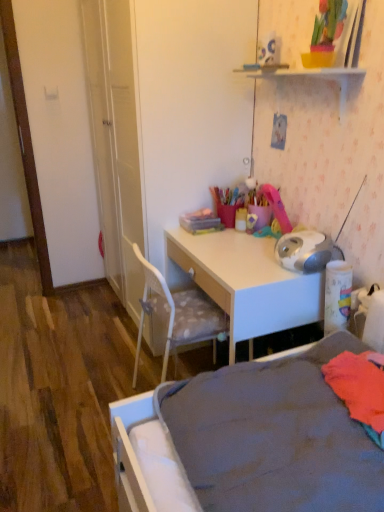
Locate an element on the screen. This screenshot has width=384, height=512. white glossy desk at center is located at coordinates (244, 282).

Where is `gray fabric bed at lower right`? Image resolution: width=384 pixels, height=512 pixels. gray fabric bed at lower right is located at coordinates [x=275, y=437].

Where is `white plastic shelf at upper center`? The height and width of the screenshot is (512, 384). white plastic shelf at upper center is located at coordinates (311, 77).

From a real-world perspective, is white plastic shelf at upper center physically below white glossy desk at center?

Actually, white plastic shelf at upper center is physically above white glossy desk at center in the real world.

Is white plastic shelf at upper center aimed at white glossy desk at center?

No, white plastic shelf at upper center does not turn towards white glossy desk at center.

Between white plastic shelf at upper center and white glossy desk at center, which one has smaller size?

With smaller size is white plastic shelf at upper center.

Is white glossy desk at center far away from white plastic shelf at upper center?

No, there isn't a large distance between white glossy desk at center and white plastic shelf at upper center.

Is white glossy desk at center outside of white plastic shelf at upper center?

That's correct, white glossy desk at center is outside of white plastic shelf at upper center.

Consider the image. Is white glossy desk at center taller than white plastic shelf at upper center?

Yes, white glossy desk at center is taller than white plastic shelf at upper center.

From the image's perspective, relative to white plastic shelf at upper center, is white glossy desk at center above or below?

Based on their image positions, white glossy desk at center is located beneath white plastic shelf at upper center.

Is white plastic shelf at upper center in front of gray fabric bed at lower right?

No, white plastic shelf at upper center is further to the viewer.

Is white plastic shelf at upper center taller or shorter than gray fabric bed at lower right?

white plastic shelf at upper center is taller than gray fabric bed at lower right.

Which is correct: white plastic shelf at upper center is inside gray fabric bed at lower right, or outside of it?

white plastic shelf at upper center is located beyond the bounds of gray fabric bed at lower right.

Is gray fabric bed at lower right facing away from white plastic shelf at upper center?

No, gray fabric bed at lower right is not facing the opposite direction of white plastic shelf at upper center.

Between gray fabric bed at lower right and white plastic shelf at upper center, which one has smaller size?

white plastic shelf at upper center is smaller.

Can we say gray fabric bed at lower right lies outside white plastic shelf at upper center?

gray fabric bed at lower right is positioned outside white plastic shelf at upper center.

Is gray fabric bed at lower right shorter than white plastic shelf at upper center?

Indeed, gray fabric bed at lower right has a lesser height compared to white plastic shelf at upper center.

In the scene shown: Is white glossy desk at center to the right of gray fabric bed at lower right from the viewer's perspective?

In fact, white glossy desk at center is to the left of gray fabric bed at lower right.

In the scene shown: Is white glossy desk at center behind gray fabric bed at lower right?

Yes, it is behind gray fabric bed at lower right.

Where is `bed that is in front of the white glossy desk at center`? This screenshot has width=384, height=512. bed that is in front of the white glossy desk at center is located at coordinates (275, 437).

Does white glossy desk at center have a larger size compared to gray fabric bed at lower right?

Indeed, white glossy desk at center has a larger size compared to gray fabric bed at lower right.

Is gray fabric bed at lower right inside or outside of white glossy desk at center?

gray fabric bed at lower right lies outside white glossy desk at center.

Between gray fabric bed at lower right and white glossy desk at center, which one has smaller width?

With smaller width is white glossy desk at center.

The image size is (384, 512). Find the location of `desk on the left side of gray fabric bed at lower right`. desk on the left side of gray fabric bed at lower right is located at coordinates (244, 282).

Who is bigger, gray fabric bed at lower right or white glossy desk at center?

white glossy desk at center is bigger.

Image resolution: width=384 pixels, height=512 pixels. Find the location of `desk below the white plastic shelf at upper center (from the image's perspective)`. desk below the white plastic shelf at upper center (from the image's perspective) is located at coordinates (244, 282).

Locate an element on the screen. desk lying on the left of white plastic shelf at upper center is located at coordinates (244, 282).

Consider the image. When comparing their distances from white plastic shelf at upper center, does white glossy desk at center or gray fabric bed at lower right seem further?

Among the two, gray fabric bed at lower right is located further to white plastic shelf at upper center.

Looking at the image, which one is located closer to gray fabric bed at lower right, white glossy desk at center or white plastic shelf at upper center?

The object closer to gray fabric bed at lower right is white glossy desk at center.

Looking at the image, which one is located closer to white glossy desk at center, gray fabric bed at lower right or white plastic shelf at upper center?

Among the two, gray fabric bed at lower right is located nearer to white glossy desk at center.

Considering their positions, is white plastic shelf at upper center positioned closer to gray fabric bed at lower right than white glossy desk at center?

white glossy desk at center.

Considering their positions, is gray fabric bed at lower right positioned closer to white plastic shelf at upper center than white glossy desk at center?

Based on the image, white glossy desk at center appears to be nearer to white plastic shelf at upper center.

Based on their spatial positions, is white plastic shelf at upper center or gray fabric bed at lower right closer to white glossy desk at center?

Among the two, gray fabric bed at lower right is located nearer to white glossy desk at center.

Identify the location of desk between white plastic shelf at upper center and gray fabric bed at lower right in the up-down direction. This screenshot has height=512, width=384. (244, 282).